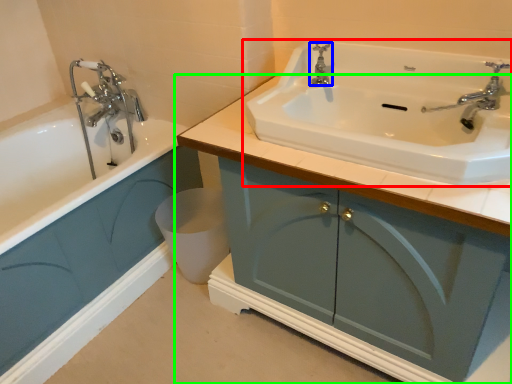
Question: Estimate the real-world distances between objects in this image. Which object is farther from sink (highlighted by a red box), tap (highlighted by a blue box) or bathroom cabinet (highlighted by a green box)?

Choices:
 (A) tap
 (B) bathroom cabinet

Answer: (A)